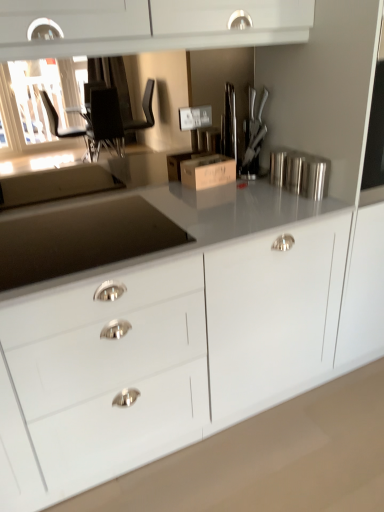
Question: Looking at the image, does silver metallic canister at upper right seem bigger or smaller compared to brown cardboard box at center?

Choices:
 (A) small
 (B) big

Answer: (A)

Question: Is silver metallic canister at upper right wider or thinner than brown cardboard box at center?

Choices:
 (A) thin
 (B) wide

Answer: (A)

Question: From a real-world perspective, is silver metallic canister at upper right above or below brown cardboard box at center?

Choices:
 (A) above
 (B) below

Answer: (A)

Question: Would you say brown cardboard box at center is inside or outside silver metallic canister at upper right?

Choices:
 (A) inside
 (B) outside

Answer: (B)

Question: Considering the positions of brown cardboard box at center and silver metallic canister at upper right in the image, is brown cardboard box at center wider or thinner than silver metallic canister at upper right?

Choices:
 (A) wide
 (B) thin

Answer: (A)

Question: From the image's perspective, relative to silver metallic canister at upper right, is brown cardboard box at center above or below?

Choices:
 (A) above
 (B) below

Answer: (A)

Question: From a real-world perspective, is brown cardboard box at center above or below silver metallic canister at upper right?

Choices:
 (A) above
 (B) below

Answer: (B)